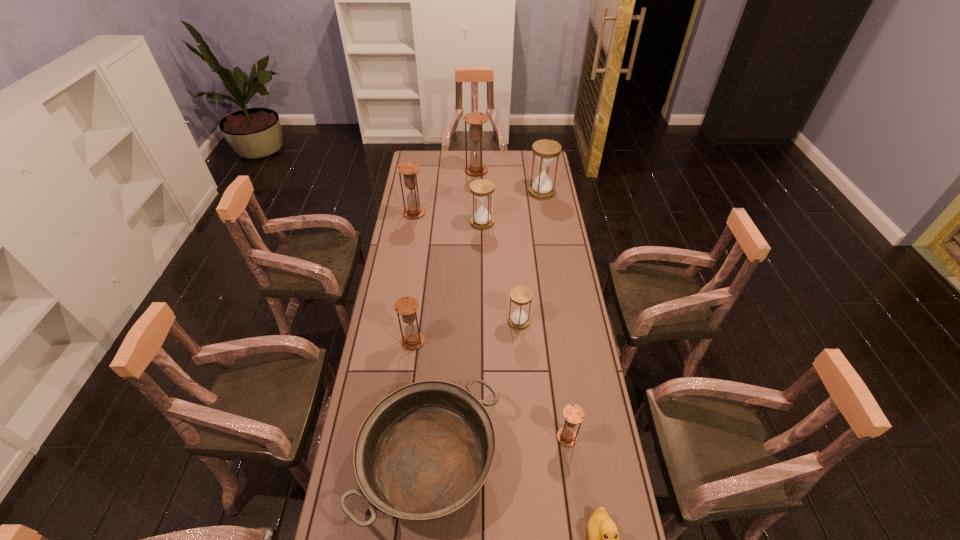
The height and width of the screenshot is (540, 960). Identify the location of the farthest object. (475, 120).

This screenshot has width=960, height=540. Find the location of `the tallest hourglass`. the tallest hourglass is located at coordinates (475, 120).

This screenshot has width=960, height=540. Identify the location of the third smallest brown hourglass. (408, 169).

The width and height of the screenshot is (960, 540). I want to click on the rightmost white hourglass, so click(x=546, y=151).

Where is `the second farthest hourglass`? The width and height of the screenshot is (960, 540). the second farthest hourglass is located at coordinates pos(546,151).

Image resolution: width=960 pixels, height=540 pixels. In order to click on the second biggest white hourglass in this screenshot , I will do `click(481, 189)`.

Where is `the leftmost white hourglass`? This screenshot has height=540, width=960. the leftmost white hourglass is located at coordinates pos(481,189).

Find the location of a particular element. The width and height of the screenshot is (960, 540). the third farthest brown hourglass is located at coordinates (407, 306).

This screenshot has width=960, height=540. Find the location of `the second nearest hourglass`. the second nearest hourglass is located at coordinates (407, 306).

Identify the location of the third nearest hourglass. (520, 295).